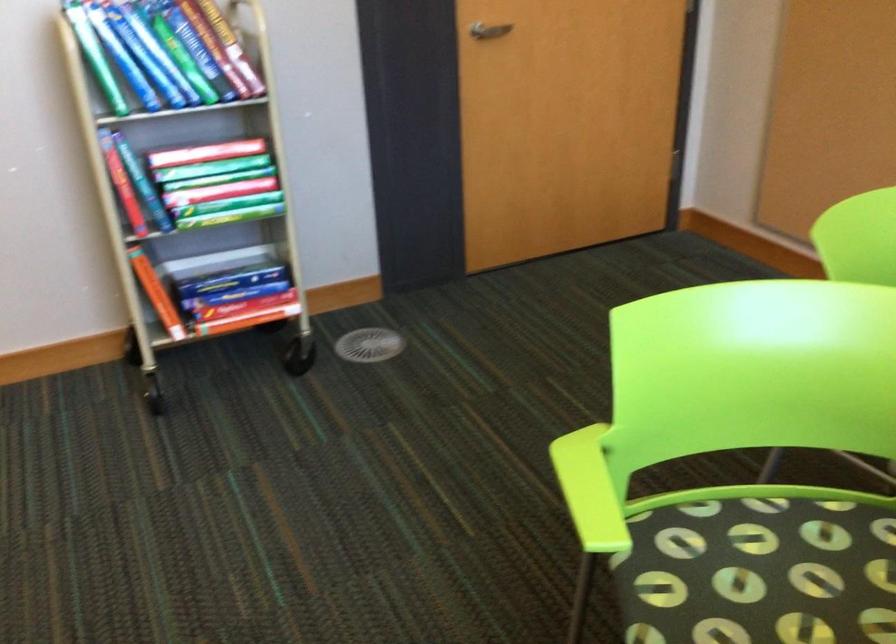
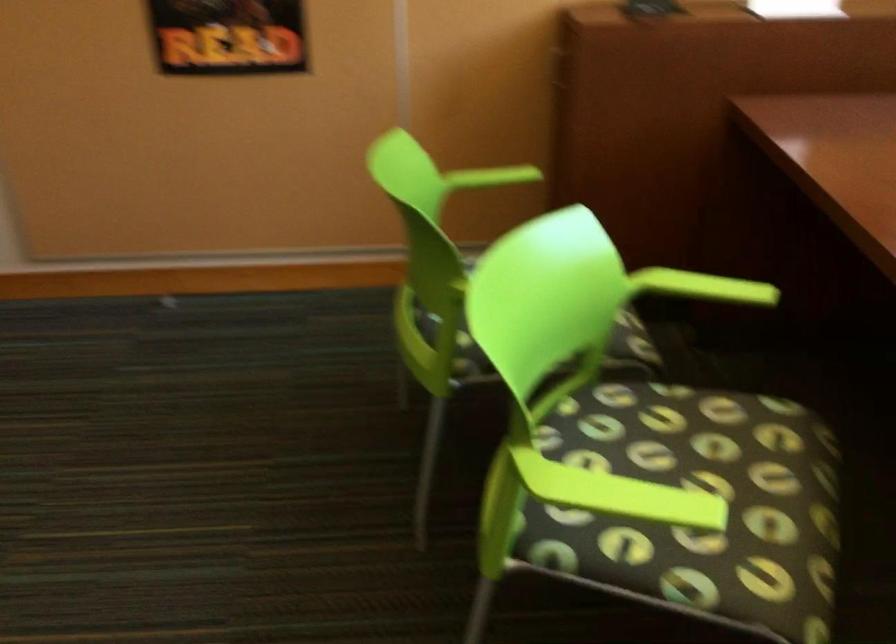
Locate, in the second image, the point that corresponds to point (607, 489) in the first image.

(619, 494)